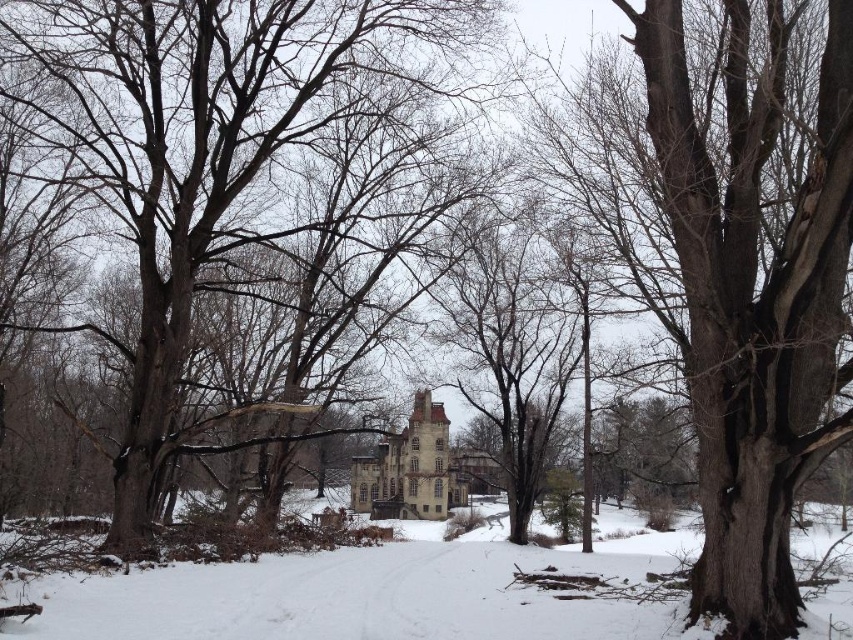
Does smooth brown tree trunk at center appear on the right side of white powdery snow at center?

Incorrect, smooth brown tree trunk at center is not on the right side of white powdery snow at center.

Which is below, smooth brown tree trunk at center or white powdery snow at center?

white powdery snow at center is lower down.

I want to click on smooth brown tree trunk at center, so click(x=259, y=198).